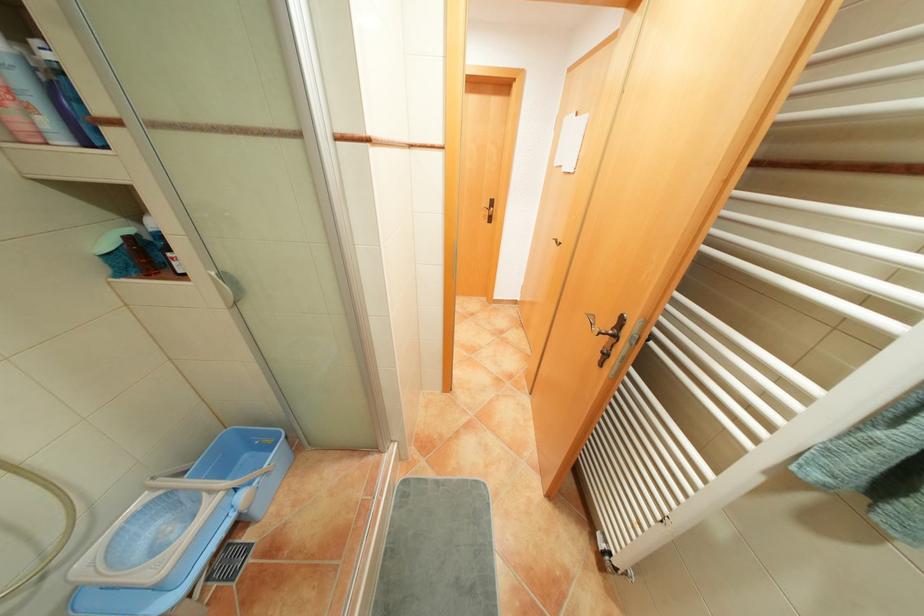
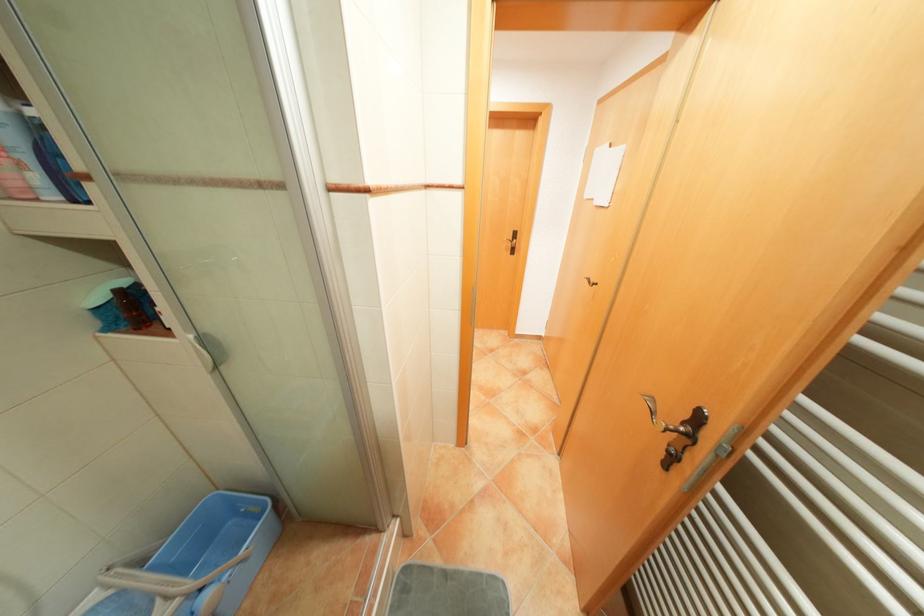
Question: The images are taken continuously from a first-person perspective. In which direction is your viewpoint rotating?

Choices:
 (A) Left
 (B) Right
 (C) Up
 (D) Down

Answer: (C)